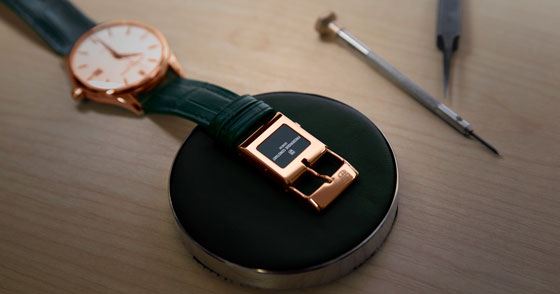
I want to click on charger, so click(259, 207).